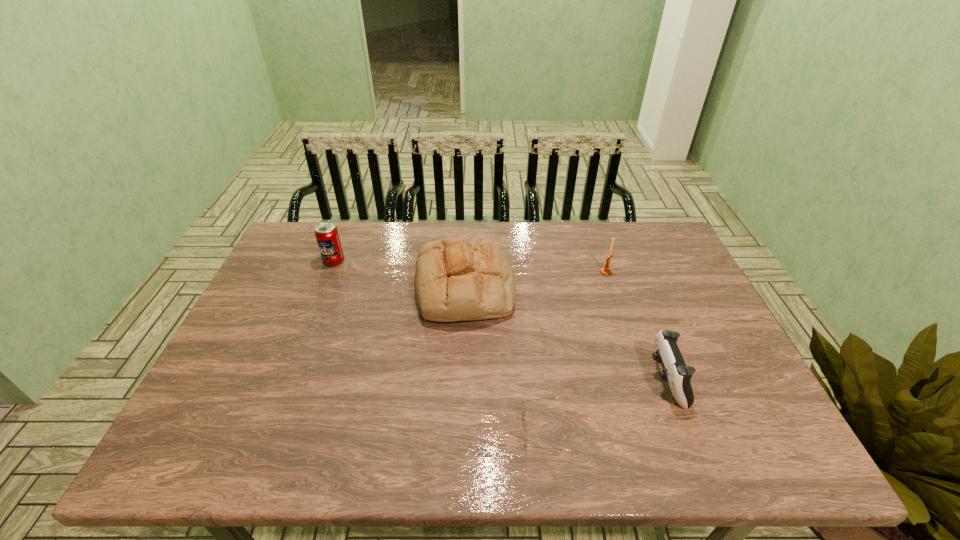
Locate an element on the screen. free space located 0.180m on the front-facing side of the second shortest object is located at coordinates (576, 380).

You are a GUI agent. You are given a task and a screenshot of the screen. Output one action in this format:
    pyautogui.click(x=<x>, y=<y>)
    Task: Click on the vacant area situated 0.320m on the front-facing side of the second shortest object
    Image resolution: width=960 pixels, height=540 pixels.
    Given the screenshot: What is the action you would take?
    pyautogui.click(x=517, y=380)

The height and width of the screenshot is (540, 960). In order to click on free space located on the temples of the spectacles in this screenshot , I will do pyautogui.click(x=411, y=429).

At what (x,y) coordinates should I click in order to perform the action: click on vacant space located 0.250m on the temples of the spectacles. Please return your answer as a coordinate pair (x, y). Image resolution: width=960 pixels, height=540 pixels. Looking at the image, I should click on (406, 429).

This screenshot has width=960, height=540. I want to click on vacant space located 0.060m on the temples of the spectacles, so click(x=493, y=429).

Identify the location of bread situated at the far edge. The width and height of the screenshot is (960, 540). (456, 279).

Find the location of a particular element. The width and height of the screenshot is (960, 540). soda can positioned at the far edge is located at coordinates (327, 236).

At what (x,y) coordinates should I click in order to perform the action: click on object that is positioned at the near edge. Please return your answer as a coordinate pair (x, y). Looking at the image, I should click on (523, 407).

Image resolution: width=960 pixels, height=540 pixels. In order to click on object that is at the left edge in this screenshot , I will do `click(327, 236)`.

This screenshot has height=540, width=960. Find the location of `object at the far left corner`. object at the far left corner is located at coordinates (327, 236).